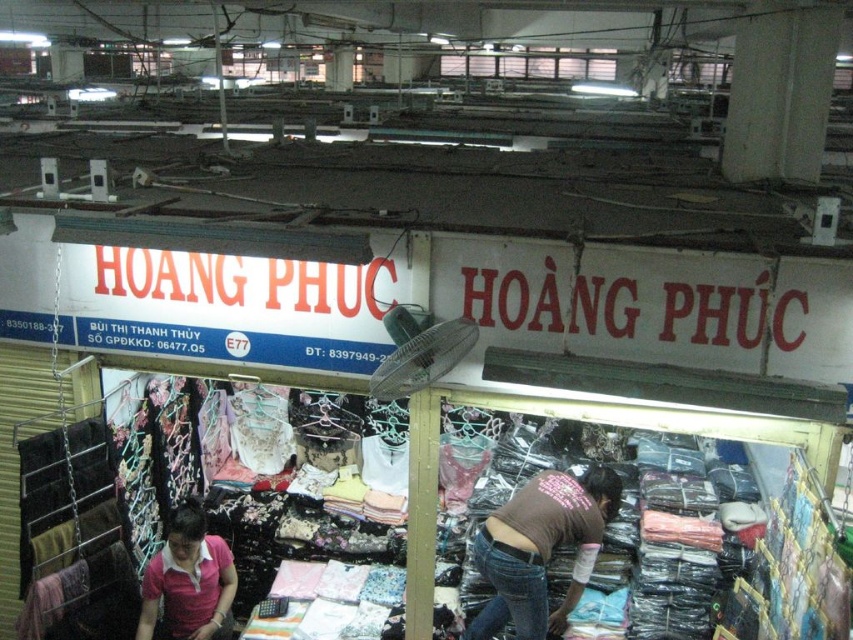
Question: Is denim jeans at center above pink cotton polo shirt at lower left?

Choices:
 (A) yes
 (B) no

Answer: (A)

Question: From the image, what is the correct spatial relationship of denim jeans at center in relation to pink cotton polo shirt at lower left?

Choices:
 (A) left
 (B) right

Answer: (B)

Question: Can you confirm if denim jeans at center is positioned above pink cotton polo shirt at lower left?

Choices:
 (A) yes
 (B) no

Answer: (A)

Question: Among these objects, which one is farthest from the camera?

Choices:
 (A) pink cotton polo shirt at lower left
 (B) denim jeans at center

Answer: (A)